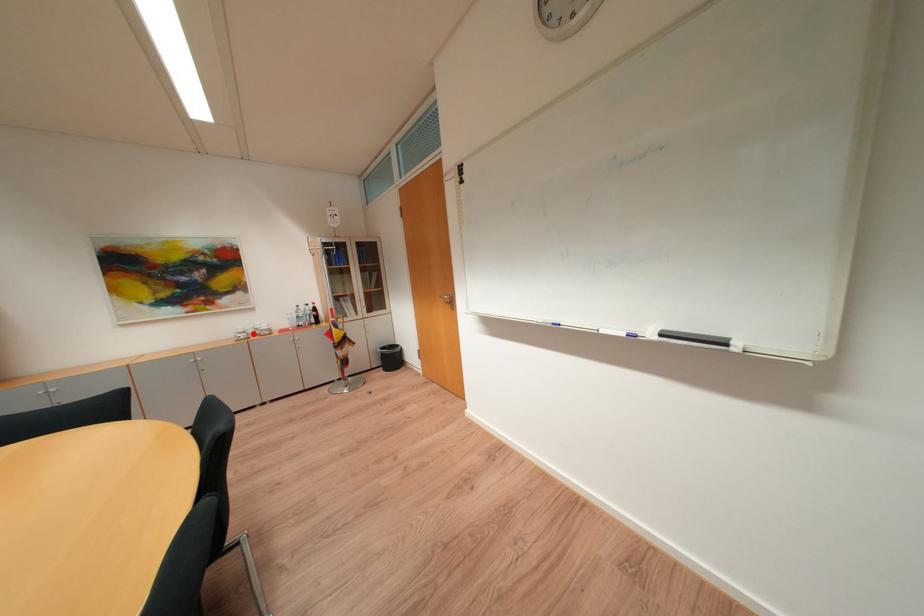
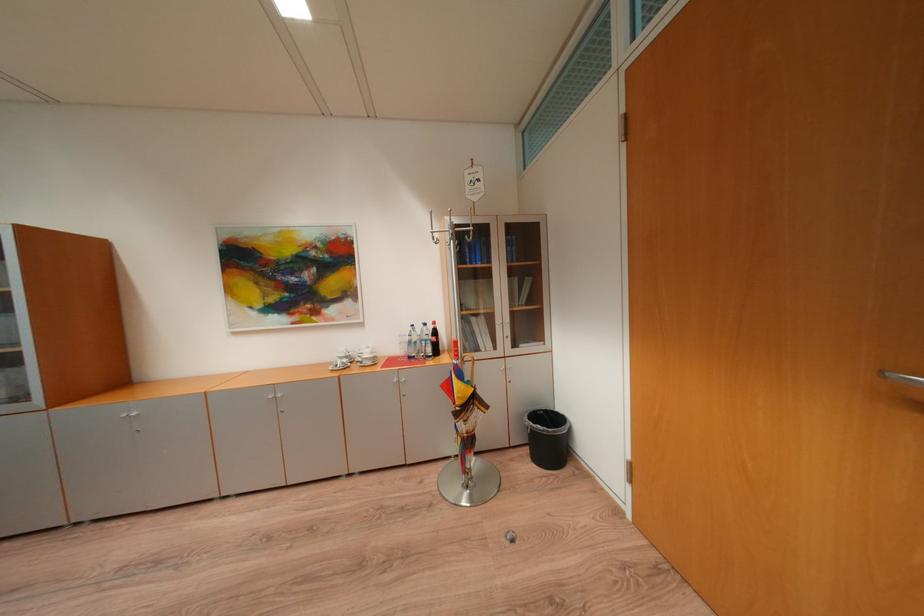
Find the pixel in the second image that matches the highlighted location in the first image.

(355, 359)